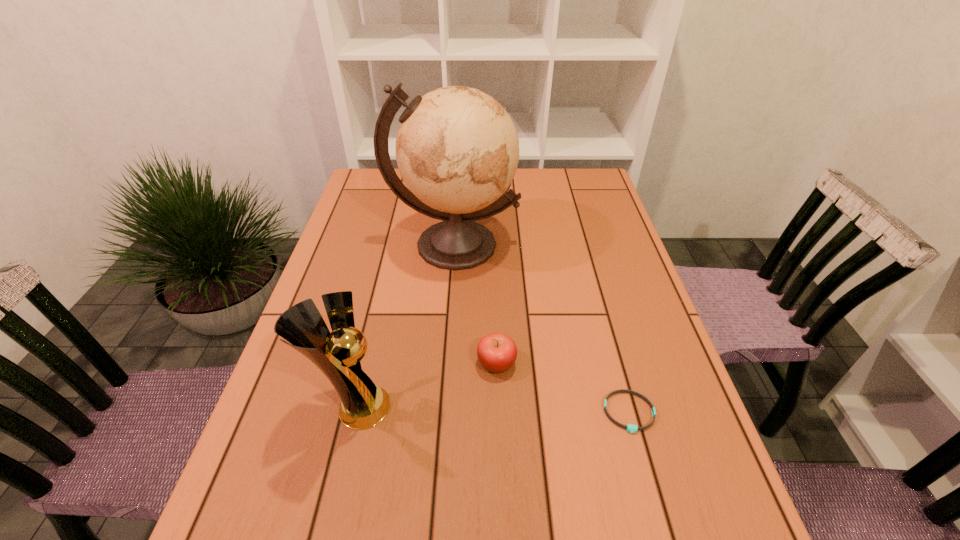
Where is `the farthest object`? The width and height of the screenshot is (960, 540). the farthest object is located at coordinates (457, 149).

Identify the location of globe. (457, 149).

This screenshot has height=540, width=960. Find the location of `award`. award is located at coordinates (363, 405).

You are a GUI agent. You are given a task and a screenshot of the screen. Output one action in this format:
    pyautogui.click(x=<x>, y=<y>)
    Task: Click on the apple
    
    Given the screenshot: What is the action you would take?
    pyautogui.click(x=497, y=352)

Where is `the rightmost object`? Image resolution: width=960 pixels, height=540 pixels. the rightmost object is located at coordinates (631, 428).

In order to click on wristband in this screenshot , I will do `click(631, 428)`.

You are a GUI agent. You are given a task and a screenshot of the screen. Output one action in this format:
    pyautogui.click(x=<x>, y=<y>)
    Task: Click on the free space located 0.170m on the front-facing side of the globe
    Image resolution: width=960 pixels, height=540 pixels.
    Given the screenshot: What is the action you would take?
    pyautogui.click(x=448, y=329)

Where is `free region located 0.380m at the front of the award, where the globe is visible`? This screenshot has height=540, width=960. free region located 0.380m at the front of the award, where the globe is visible is located at coordinates (580, 407).

Identify the location of vacant space located 0.290m on the right of the apple. This screenshot has height=540, width=960. 649,363.

The height and width of the screenshot is (540, 960). Find the location of `free space located 0.140m on the buckle of the rightmost object`. free space located 0.140m on the buckle of the rightmost object is located at coordinates (657, 512).